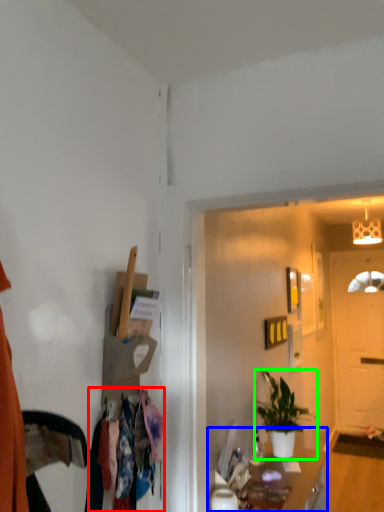
Question: Based on their relative distances, which object is farther from clothing (highlighted by a red box)? Choose from cabinetry (highlighted by a blue box) and houseplant (highlighted by a green box).

Choices:
 (A) cabinetry
 (B) houseplant

Answer: (B)